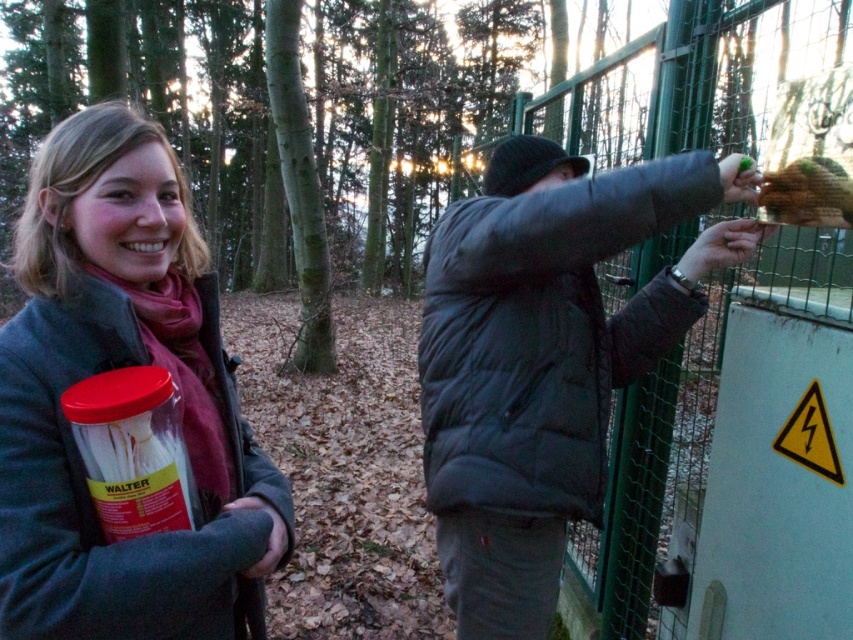
Is matte gray coat at center thinner than green matte food at upper right?

No, matte gray coat at center is not thinner than green matte food at upper right.

Can you confirm if matte gray coat at center is positioned above green matte food at upper right?

No, matte gray coat at center is not above green matte food at upper right.

Where is `matte gray coat at center`? matte gray coat at center is located at coordinates (117, 368).

Where is `matte gray coat at center`? The height and width of the screenshot is (640, 853). matte gray coat at center is located at coordinates (117, 368).

From the picture: Who is more forward, (525, 244) or (798, 161)?

Point (525, 244) is more forward.

Can you confirm if dark gray puffer jacket at center is shorter than green matte food at upper right?

Incorrect, dark gray puffer jacket at center's height does not fall short of green matte food at upper right's.

Which is in front, point (672, 198) or point (805, 161)?

Point (672, 198)

You are a GUI agent. You are given a task and a screenshot of the screen. Output one action in this format:
    pyautogui.click(x=<x>, y=<y>)
    Task: Click on the dark gray puffer jacket at center
    
    Given the screenshot: What is the action you would take?
    pyautogui.click(x=546, y=356)

Which is above, matte gray coat at center or dark gray puffer jacket at center?

matte gray coat at center

Is point (83, 312) positioned after point (491, 474)?

No.

Identify the location of matte gray coat at center. (117, 368).